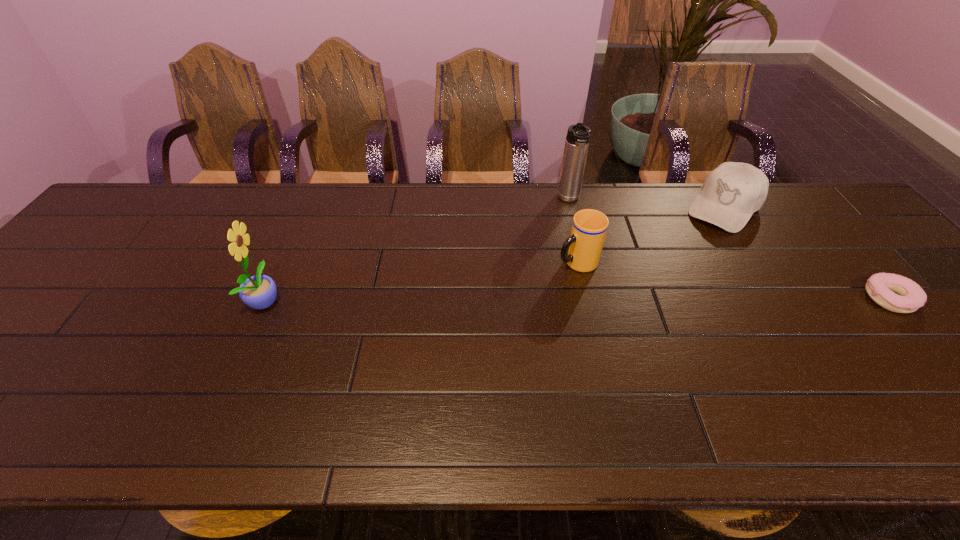
Where is `vacant space at the far edge of the desktop`? vacant space at the far edge of the desktop is located at coordinates (589, 198).

Locate an element on the screen. vacant position at the near edge of the desktop is located at coordinates (252, 367).

At what (x,y) coordinates should I click in order to perform the action: click on vacant space at the right edge. Please return your answer as a coordinate pair (x, y). Image resolution: width=960 pixels, height=540 pixels. Looking at the image, I should click on (943, 326).

At what (x,y) coordinates should I click in order to perform the action: click on empty space between the cup and the baseball cap. Please return your answer as a coordinate pair (x, y). Looking at the image, I should click on (650, 235).

Locate an element on the screen. This screenshot has width=960, height=540. free spot between the baseball cap and the thermos bottle is located at coordinates (646, 204).

Locate an element on the screen. vacant space that is in between the baseball cap and the sunflower is located at coordinates 494,254.

Find the location of a particular element. Image resolution: width=960 pixels, height=540 pixels. vacant region between the baseball cap and the shortest object is located at coordinates (806, 253).

Locate an element on the screen. The height and width of the screenshot is (540, 960). unoccupied position between the second object from right to left and the sunflower is located at coordinates (494, 254).

Where is `vacant space that's between the thermos bottle and the leftmost object`? This screenshot has width=960, height=540. vacant space that's between the thermos bottle and the leftmost object is located at coordinates (418, 250).

At what (x,y) coordinates should I click in order to perform the action: click on free spot between the thermos bottle and the baseball cap. Please return your answer as a coordinate pair (x, y). The height and width of the screenshot is (540, 960). Looking at the image, I should click on (646, 204).